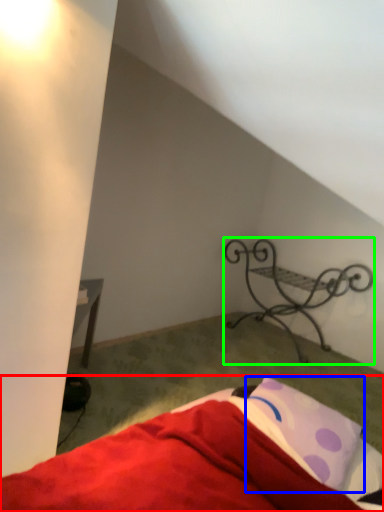
Question: Estimate the real-world distances between objects in this image. Which object is farther from bed (highlighted by a red box), pillow (highlighted by a blue box) or furniture (highlighted by a green box)?

Choices:
 (A) pillow
 (B) furniture

Answer: (B)